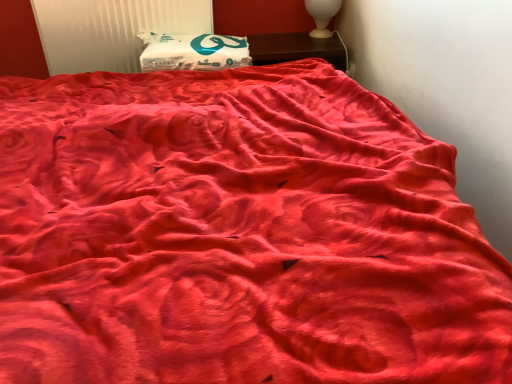
The height and width of the screenshot is (384, 512). What do you see at coordinates (193, 52) in the screenshot? I see `white matte pillow at upper center` at bounding box center [193, 52].

The height and width of the screenshot is (384, 512). What do you see at coordinates (322, 15) in the screenshot? I see `white glossy table lamp at upper right` at bounding box center [322, 15].

The image size is (512, 384). In order to click on white matte pillow at upper center in this screenshot , I will do `click(193, 52)`.

Is wooden nightstand at upper center inside or outside of white plastic radiator at upper left?

wooden nightstand at upper center is located beyond the bounds of white plastic radiator at upper left.

Is wooden nightstand at upper center to the left or to the right of white plastic radiator at upper left in the image?

Based on their positions, wooden nightstand at upper center is located to the right of white plastic radiator at upper left.

From the image's perspective, is wooden nightstand at upper center positioned above or below white plastic radiator at upper left?

Based on their image positions, wooden nightstand at upper center is located beneath white plastic radiator at upper left.

Which object is closer to the camera, wooden nightstand at upper center or white plastic radiator at upper left?

white plastic radiator at upper left is in front.

Can you confirm if white glossy table lamp at upper right is thinner than white matte pillow at upper center?

Indeed, white glossy table lamp at upper right has a lesser width compared to white matte pillow at upper center.

Does point (339, 5) lie behind point (180, 60)?

Yes.

Is white glossy table lamp at upper right looking in the opposite direction of white matte pillow at upper center?

white glossy table lamp at upper right does not have its back to white matte pillow at upper center.

From the image's perspective, which one is positioned higher, white plastic radiator at upper left or white matte pillow at upper center?

white plastic radiator at upper left.

Is white plastic radiator at upper left to the left or to the right of white matte pillow at upper center in the image?

white plastic radiator at upper left is positioned on white matte pillow at upper center's left side.

Considering the relative sizes of white plastic radiator at upper left and white matte pillow at upper center in the image provided, is white plastic radiator at upper left wider than white matte pillow at upper center?

In fact, white plastic radiator at upper left might be narrower than white matte pillow at upper center.

Is white plastic radiator at upper left placed right next to white matte pillow at upper center?

white plastic radiator at upper left is not next to white matte pillow at upper center, and they're not touching.

Is white glossy table lamp at upper right directly adjacent to white plastic radiator at upper left?

white glossy table lamp at upper right and white plastic radiator at upper left are not in contact.

Considering the relative sizes of white glossy table lamp at upper right and white plastic radiator at upper left in the image provided, is white glossy table lamp at upper right smaller than white plastic radiator at upper left?

Yes.

Is white plastic radiator at upper left surrounded by white glossy table lamp at upper right?

No.

From a real-world perspective, is white matte pillow at upper center physically located above or below wooden nightstand at upper center?

Clearly, from a real-world perspective, white matte pillow at upper center is above wooden nightstand at upper center.

Is wooden nightstand at upper center at the back of white matte pillow at upper center?

No, white matte pillow at upper center's orientation is not away from wooden nightstand at upper center.

Does white matte pillow at upper center have a greater height compared to wooden nightstand at upper center?

Yes.

From the image's perspective, which is above, white glossy table lamp at upper right or wooden nightstand at upper center?

white glossy table lamp at upper right is shown above in the image.

Image resolution: width=512 pixels, height=384 pixels. Find the location of `furniture that appears below the white glossy table lamp at upper right (from a real-world perspective)`. furniture that appears below the white glossy table lamp at upper right (from a real-world perspective) is located at coordinates (x=296, y=48).

From the picture: Is white glossy table lamp at upper right oriented towards wooden nightstand at upper center?

No, white glossy table lamp at upper right is not oriented towards wooden nightstand at upper center.

Between white glossy table lamp at upper right and wooden nightstand at upper center, which one has less height?

wooden nightstand at upper center.

Can you tell me how much white plastic radiator at upper left and white glossy table lamp at upper right differ in facing direction?

white plastic radiator at upper left and white glossy table lamp at upper right are facing 2.5 degrees away from each other.

Is white plastic radiator at upper left closer to the viewer compared to white glossy table lamp at upper right?

Yes, white plastic radiator at upper left is closer to the viewer.

Considering the relative sizes of white plastic radiator at upper left and white glossy table lamp at upper right in the image provided, is white plastic radiator at upper left bigger than white glossy table lamp at upper right?

Yes, white plastic radiator at upper left is bigger than white glossy table lamp at upper right.

From a real-world perspective, between white plastic radiator at upper left and white glossy table lamp at upper right, who is vertically higher?

white glossy table lamp at upper right is physically above.

Find the location of a particular element. The image size is (512, 384). radiator that appears on the left of wooden nightstand at upper center is located at coordinates (111, 30).

Identify the location of table lamp above the white matte pillow at upper center (from a real-world perspective). The height and width of the screenshot is (384, 512). (322, 15).

When comparing their distances from white plastic radiator at upper left, does wooden nightstand at upper center or white glossy table lamp at upper right seem closer?

The object closer to white plastic radiator at upper left is wooden nightstand at upper center.

From the image, which object appears to be farther from white matte pillow at upper center, wooden nightstand at upper center or white plastic radiator at upper left?

Based on the image, wooden nightstand at upper center appears to be further to white matte pillow at upper center.

Looking at this image, looking at the image, which one is located further to white glossy table lamp at upper right, white plastic radiator at upper left or white matte pillow at upper center?

white plastic radiator at upper left lies further to white glossy table lamp at upper right than the other object.

Considering their positions, is white plastic radiator at upper left positioned closer to wooden nightstand at upper center than white matte pillow at upper center?

Based on the image, white matte pillow at upper center appears to be nearer to wooden nightstand at upper center.

Considering their positions, is white matte pillow at upper center positioned further to wooden nightstand at upper center than white glossy table lamp at upper right?

Among the two, white matte pillow at upper center is located further to wooden nightstand at upper center.

Which object lies further to the anchor point white matte pillow at upper center, wooden nightstand at upper center or white glossy table lamp at upper right?

white glossy table lamp at upper right is further to white matte pillow at upper center.

When comparing their distances from white plastic radiator at upper left, does white glossy table lamp at upper right or white matte pillow at upper center seem closer?

white matte pillow at upper center is closer to white plastic radiator at upper left.

Based on their spatial positions, is white glossy table lamp at upper right or white plastic radiator at upper left closer to white matte pillow at upper center?

Among the two, white plastic radiator at upper left is located nearer to white matte pillow at upper center.

Where is `furniture between white plastic radiator at upper left and white glossy table lamp at upper right`? furniture between white plastic radiator at upper left and white glossy table lamp at upper right is located at coordinates (296, 48).

Locate an element on the screen. The width and height of the screenshot is (512, 384). furniture between white matte pillow at upper center and white glossy table lamp at upper right is located at coordinates (296, 48).

In order to click on pillow between white plastic radiator at upper left and white glossy table lamp at upper right from left to right in this screenshot , I will do `click(193, 52)`.

Where is `pillow located between white plastic radiator at upper left and wooden nightstand at upper center in the left-right direction`? Image resolution: width=512 pixels, height=384 pixels. pillow located between white plastic radiator at upper left and wooden nightstand at upper center in the left-right direction is located at coordinates (193, 52).